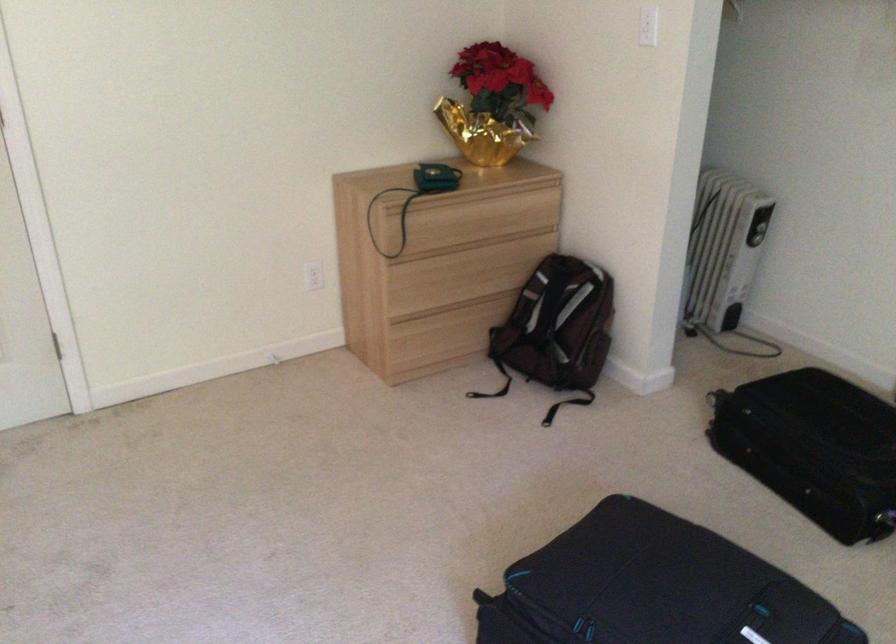
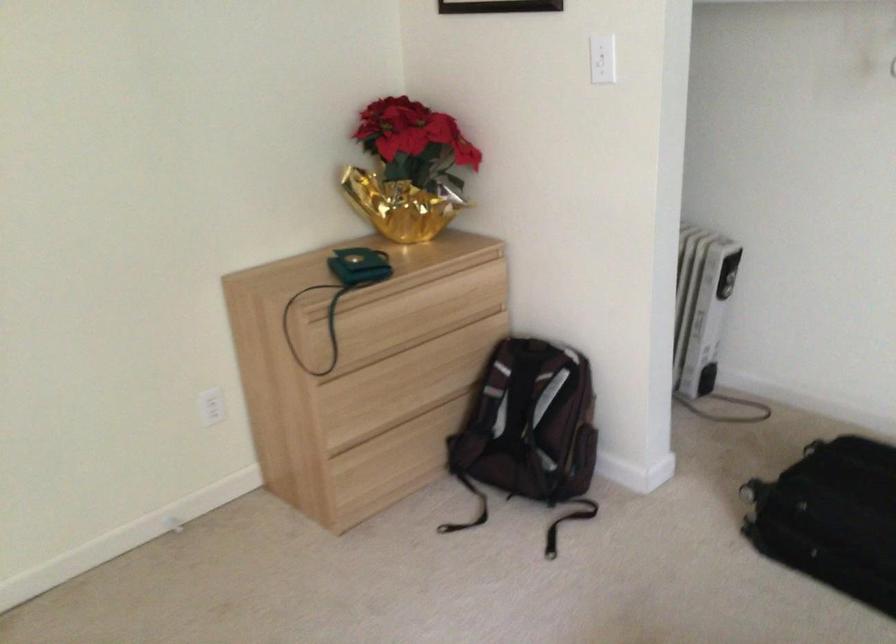
The point at [426,281] is marked in the first image. Where is the corresponding point in the second image?

(366, 397)